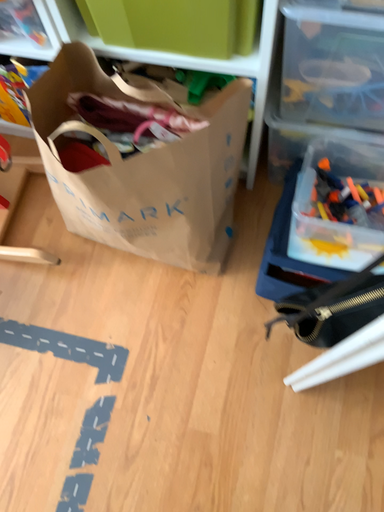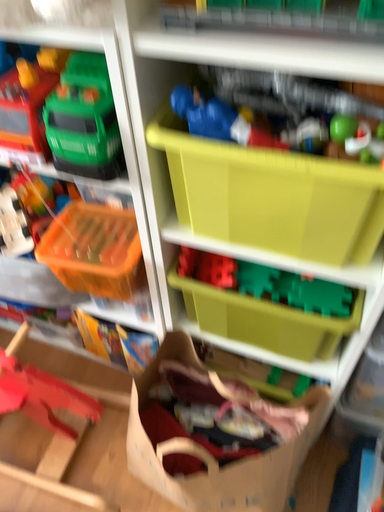
Question: Which way did the camera rotate in the video?

Choices:
 (A) rotated upward
 (B) rotated downward

Answer: (A)